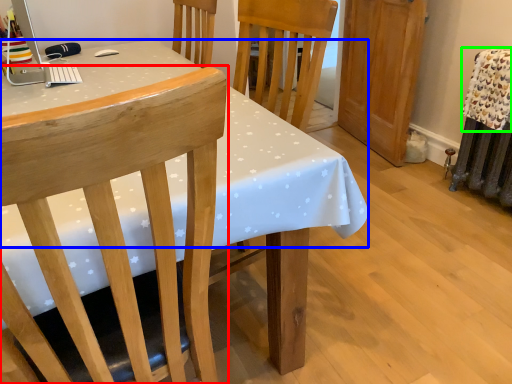
Question: Which object is positioned closest to chair (highlighted by a red box)? Select from tablecloth (highlighted by a blue box) and blanket (highlighted by a green box).

Choices:
 (A) tablecloth
 (B) blanket

Answer: (A)